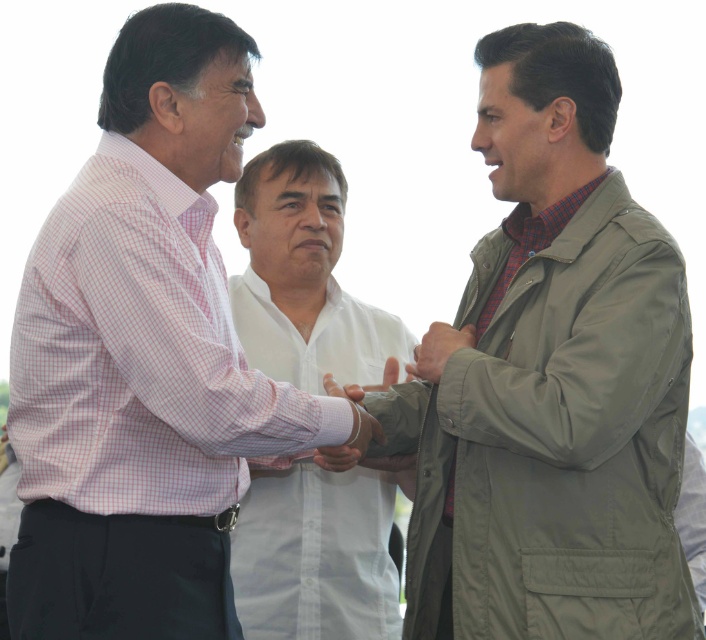
Who is positioned more to the right, olive green fabric trench coat at center or white cotton shirt at center?

Positioned to the right is olive green fabric trench coat at center.

Who is lower down, olive green fabric trench coat at center or white cotton shirt at center?

white cotton shirt at center is lower down.

Between point (602, 556) and point (253, 547), which one is positioned in front?

Point (602, 556)

The width and height of the screenshot is (706, 640). Find the location of `olive green fabric trench coat at center`. olive green fabric trench coat at center is located at coordinates (550, 380).

Who is positioned more to the right, olive green fabric trench coat at center or pink checkered shirt at left?

From the viewer's perspective, olive green fabric trench coat at center appears more on the right side.

Which is below, olive green fabric trench coat at center or pink checkered shirt at left?

Positioned lower is olive green fabric trench coat at center.

Does point (616, 216) come farther from viewer compared to point (90, 632)?

Yes, it is.

The height and width of the screenshot is (640, 706). What are the coordinates of `olive green fabric trench coat at center` in the screenshot? It's located at tap(550, 380).

Where is `pink checkered shirt at left`? pink checkered shirt at left is located at coordinates (145, 358).

Who is shorter, pink checkered shirt at left or white cotton shirt at center?

pink checkered shirt at left is shorter.

This screenshot has width=706, height=640. Find the location of `pink checkered shirt at left`. pink checkered shirt at left is located at coordinates (145, 358).